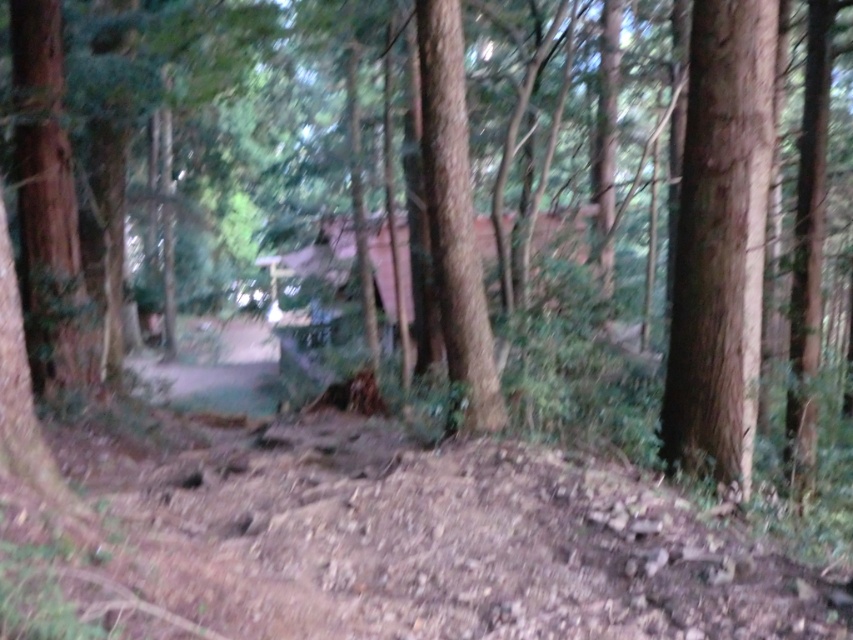
Question: Which object appears closest to the camera in this image?

Choices:
 (A) brown dirt track at lower center
 (B) smooth brown tree trunk at center

Answer: (A)

Question: Is the position of brown dirt track at lower center less distant than that of smooth brown tree trunk at center?

Choices:
 (A) yes
 (B) no

Answer: (A)

Question: Which object appears closest to the camera in this image?

Choices:
 (A) smooth brown tree trunk at center
 (B) smooth brown tree trunk at right
 (C) brown dirt track at lower center

Answer: (C)

Question: Which of the following is the closest to the observer?

Choices:
 (A) (730, 216)
 (B) (318, 492)
 (C) (434, 83)

Answer: (B)

Question: From the image, what is the correct spatial relationship of brown dirt track at lower center in relation to smooth brown tree trunk at center?

Choices:
 (A) left
 (B) right

Answer: (A)

Question: Is smooth brown tree trunk at right wider than smooth brown tree trunk at center?

Choices:
 (A) no
 (B) yes

Answer: (B)